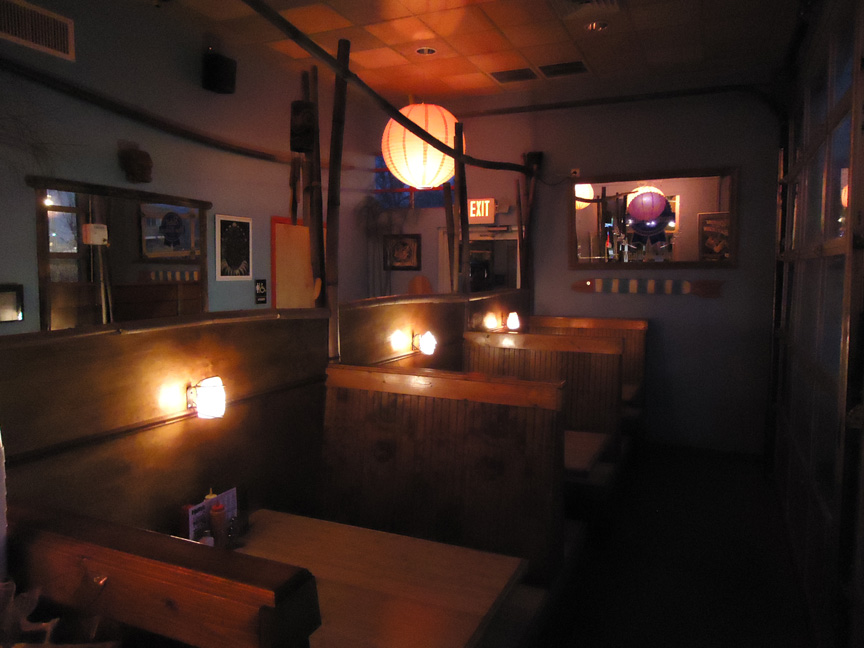
Find the location of a particular element. booths is located at coordinates (369, 566), (591, 445).